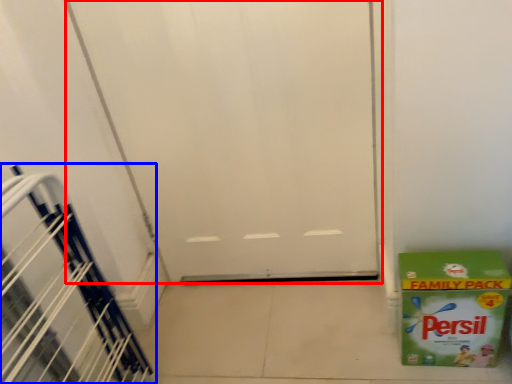
Question: Which object is closer to the camera taking this photo, door (highlighted by a red box) or stairwell (highlighted by a blue box)?

Choices:
 (A) door
 (B) stairwell

Answer: (B)